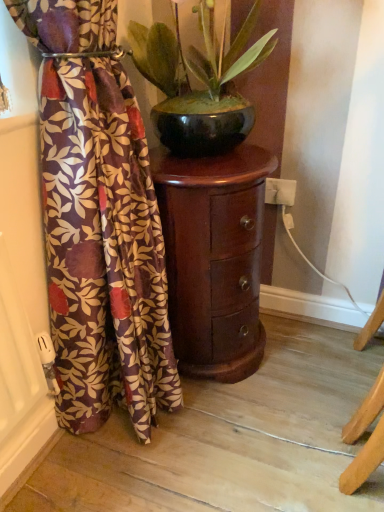
Question: Considering the relative sizes of glossy ceramic pot at center and velvet floral curtain at left in the image provided, is glossy ceramic pot at center wider than velvet floral curtain at left?

Choices:
 (A) yes
 (B) no

Answer: (A)

Question: Is glossy ceramic pot at center facing towards velvet floral curtain at left?

Choices:
 (A) no
 (B) yes

Answer: (A)

Question: Is glossy ceramic pot at center thinner than velvet floral curtain at left?

Choices:
 (A) yes
 (B) no

Answer: (B)

Question: Could velvet floral curtain at left be considered to be inside glossy ceramic pot at center?

Choices:
 (A) no
 (B) yes

Answer: (A)

Question: Considering the relative sizes of glossy ceramic pot at center and velvet floral curtain at left in the image provided, is glossy ceramic pot at center bigger than velvet floral curtain at left?

Choices:
 (A) no
 (B) yes

Answer: (A)

Question: Does point pyautogui.click(x=140, y=47) appear closer or farther from the camera than point pyautogui.click(x=81, y=77)?

Choices:
 (A) farther
 (B) closer

Answer: (A)

Question: In terms of size, does glossy ceramic pot at center appear bigger or smaller than velvet floral curtain at left?

Choices:
 (A) small
 (B) big

Answer: (A)

Question: Is glossy ceramic pot at center inside the boundaries of velvet floral curtain at left, or outside?

Choices:
 (A) inside
 (B) outside

Answer: (B)

Question: Is glossy ceramic pot at center wider or thinner than velvet floral curtain at left?

Choices:
 (A) wide
 (B) thin

Answer: (A)

Question: Considering the positions of velvet floral curtain at left and mahogany wood side table at center in the image, is velvet floral curtain at left wider or thinner than mahogany wood side table at center?

Choices:
 (A) wide
 (B) thin

Answer: (B)

Question: From a real-world perspective, is velvet floral curtain at left above or below mahogany wood side table at center?

Choices:
 (A) below
 (B) above

Answer: (B)

Question: Is velvet floral curtain at left taller or shorter than mahogany wood side table at center?

Choices:
 (A) tall
 (B) short

Answer: (A)

Question: Looking at the image, does velvet floral curtain at left seem bigger or smaller compared to mahogany wood side table at center?

Choices:
 (A) small
 (B) big

Answer: (B)

Question: Is point (246, 101) closer or farther from the camera than point (168, 294)?

Choices:
 (A) farther
 (B) closer

Answer: (B)

Question: From a real-world perspective, relative to mahogany wood side table at center, is glossy ceramic pot at center vertically above or below?

Choices:
 (A) below
 (B) above

Answer: (B)